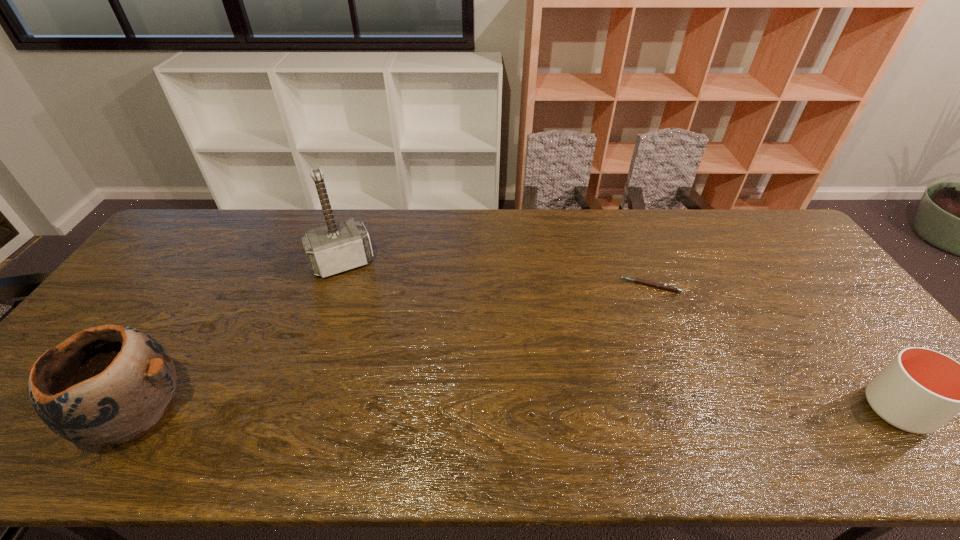
What are the coordinates of `the leftmost object` in the screenshot? It's located at (112, 383).

Where is `the third shortest object`? Image resolution: width=960 pixels, height=540 pixels. the third shortest object is located at coordinates click(x=112, y=383).

Locate an element on the screen. The image size is (960, 540). the rightmost object is located at coordinates (920, 390).

You are a GUI agent. You are given a task and a screenshot of the screen. Output one action in this format:
    pyautogui.click(x=<x>, y=<y>)
    Task: Click on the second shortest object
    
    Given the screenshot: What is the action you would take?
    pyautogui.click(x=920, y=390)

Identify the location of the tallest object. Image resolution: width=960 pixels, height=540 pixels. (338, 247).

Identify the location of the third object from right to left. pos(338,247).

Where is `the shortest object`? The image size is (960, 540). the shortest object is located at coordinates (658, 285).

This screenshot has width=960, height=540. Find the location of `the third object from left to right`. the third object from left to right is located at coordinates (658, 285).

What are the coordinates of `free location located 0.340m on the back of the second tallest object` in the screenshot? It's located at (222, 277).

Locate an element on the screen. vacant region located on the back of the rightmost object is located at coordinates (854, 353).